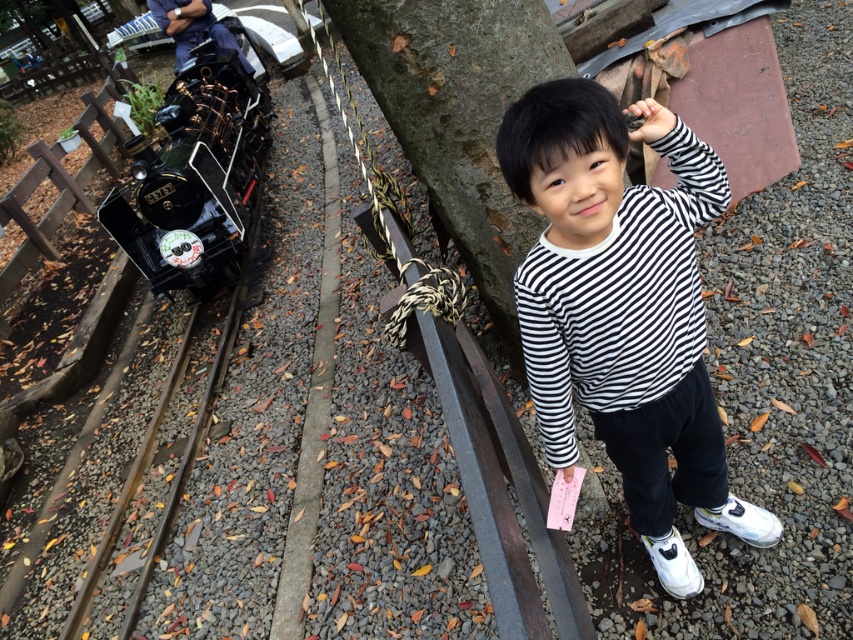
Looking at this image, you are standing at the point marked as point [194,177] in the image. What object is located at that point?

The point [194,177] indicates a shiny black locomotive at left.

You are standing at the point with coordinates point (193, 324) in the miniature railway park. You want to walk towards the point (607, 150). Which direction should you move relative to your current position?

You should move forward because point (607, 150) is in front of point (193, 324).